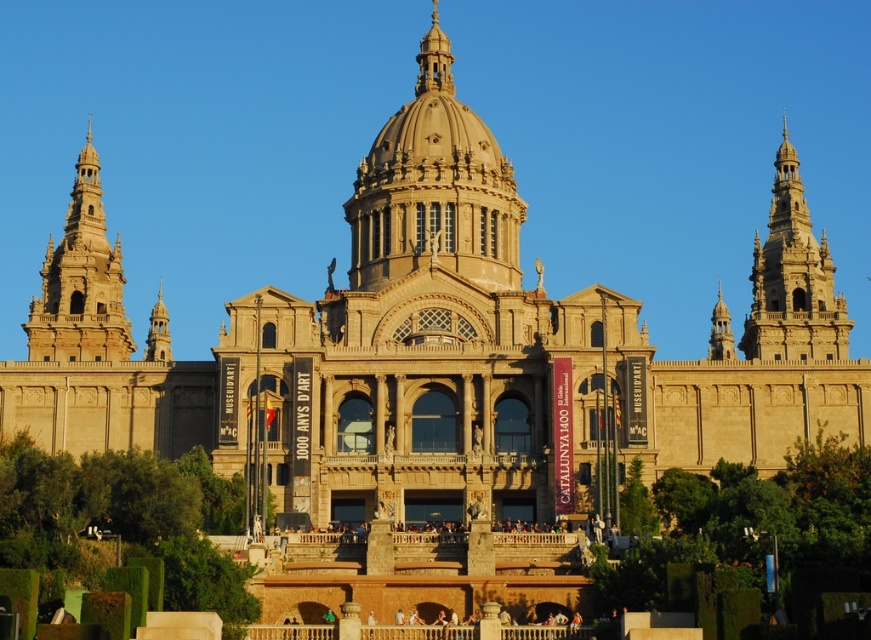
Does golden stone tower at upper right have a smaller size compared to golden stone tower at left?

Yes.

Which is in front, point (827, 332) or point (122, 340)?

Point (827, 332)

Where is `golden stone tower at upper right`? The height and width of the screenshot is (640, 871). golden stone tower at upper right is located at coordinates (793, 280).